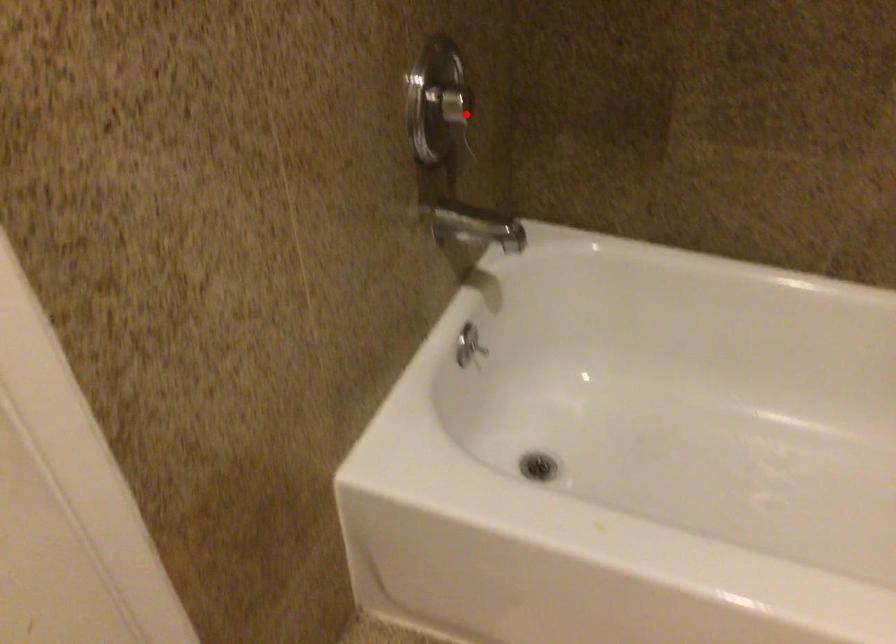
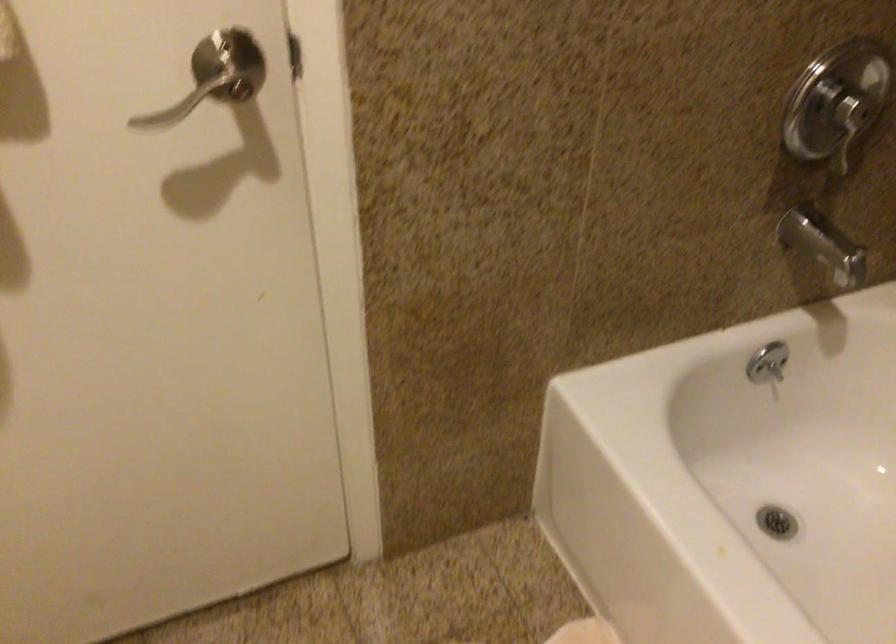
Question: I am providing you with two images of the same scene from different viewpoints. A red point is shown in image1. For the corresponding object point in image2, is it positioned nearer or farther from the camera?

Choices:
 (A) Nearer
 (B) Farther

Answer: (A)